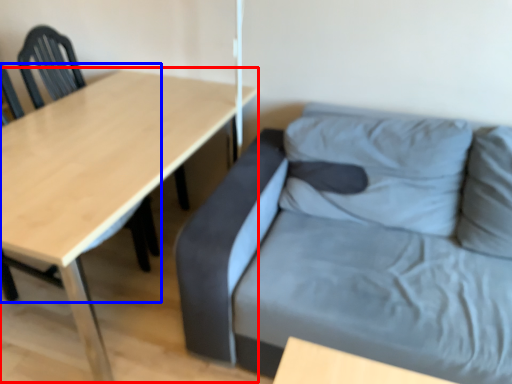
Question: Which point is closer to the camera, table (highlighted by a red box) or chair (highlighted by a blue box)?

Choices:
 (A) table
 (B) chair

Answer: (A)